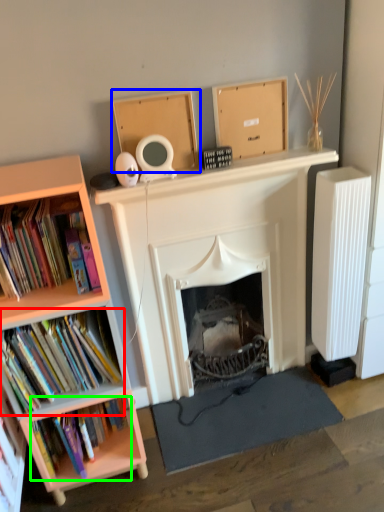
Question: Considering the real-world distances, which object is closest to book (highlighted by a red box)? cardboard box (highlighted by a blue box) or book (highlighted by a green box).

Choices:
 (A) cardboard box
 (B) book

Answer: (B)